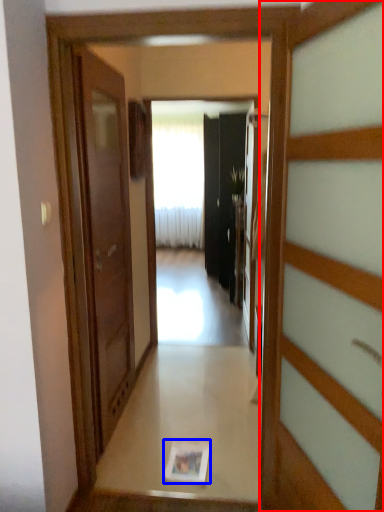
Question: Among these objects, which one is farthest to the camera, door (highlighted by a red box) or magazine (highlighted by a blue box)?

Choices:
 (A) door
 (B) magazine

Answer: (B)